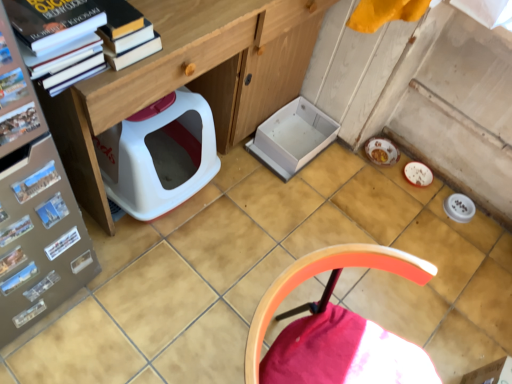
This screenshot has height=384, width=512. I want to click on vacant position to the left of wooden chair at lower right, so click(185, 326).